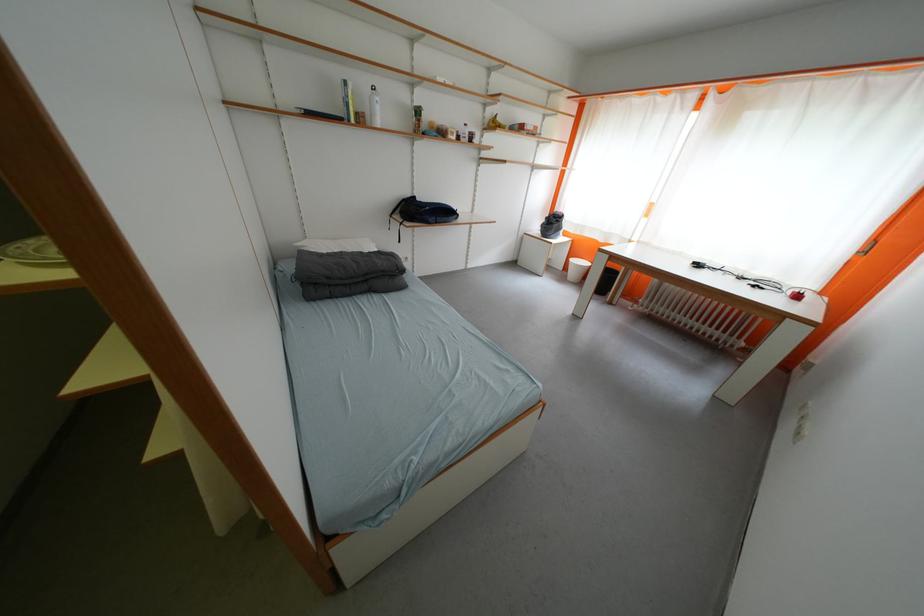
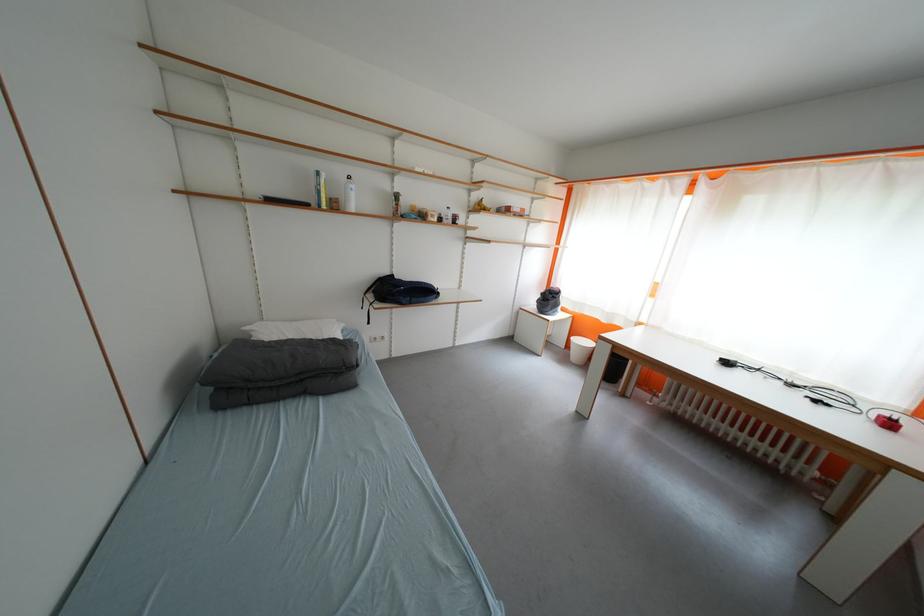
Which direction would the cameraman need to move to produce the second image?

The cameraman walked toward right, forward.